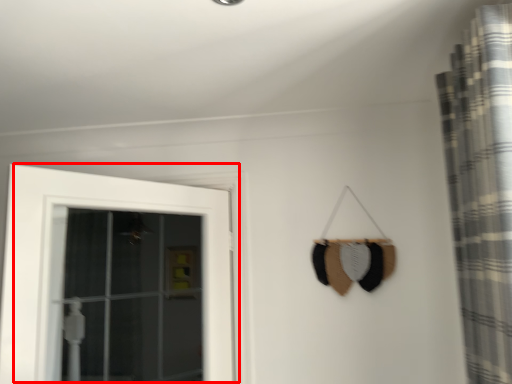
Question: From the image's perspective, considering the relative positions of door (annotated by the red box) and curtain in the image provided, where is door (annotated by the red box) located with respect to the staircase?

Choices:
 (A) below
 (B) above

Answer: (A)